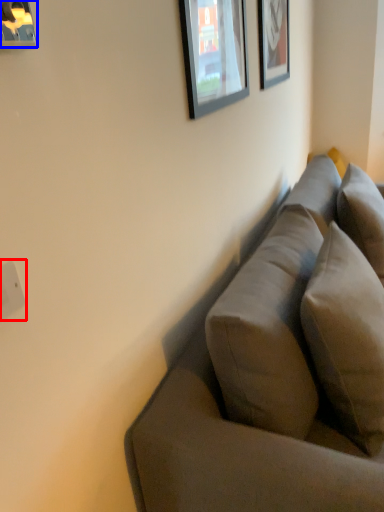
Question: Which of the following is the closest to the observer, electric outlet (highlighted by a red box) or picture frame (highlighted by a blue box)?

Choices:
 (A) electric outlet
 (B) picture frame

Answer: (B)